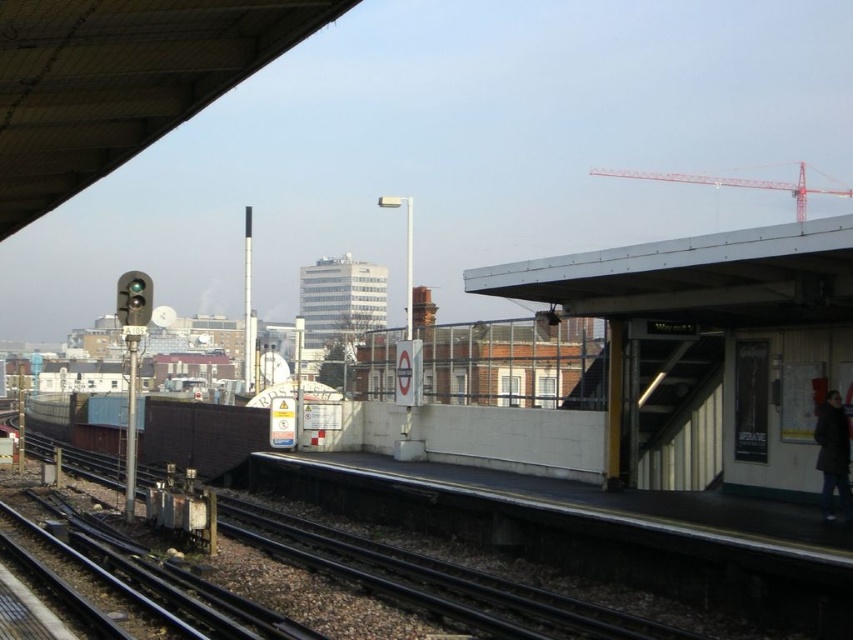
Is point (305, 540) more distant than point (840, 435)?

Yes, it is.

Between black metal track at lower left and dark gray wool coat at right, which one appears on the right side from the viewer's perspective?

From the viewer's perspective, dark gray wool coat at right appears more on the right side.

Is point (440, 577) positioned before point (845, 513)?

No.

This screenshot has width=853, height=640. Identify the location of black metal track at lower left. (432, 580).